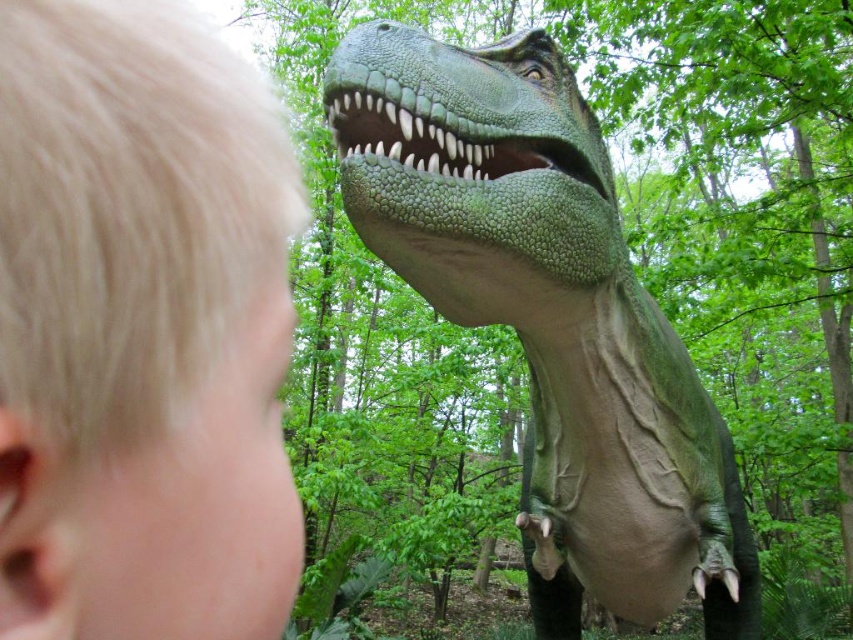
Question: Which point appears farthest from the camera in this image?

Choices:
 (A) (74, 604)
 (B) (462, 109)

Answer: (B)

Question: Is blonde hair at upper left further to the viewer compared to green scaly dinosaur at center?

Choices:
 (A) no
 (B) yes

Answer: (A)

Question: In this image, where is blonde hair at upper left located relative to green scaly dinosaur at center?

Choices:
 (A) above
 (B) below

Answer: (A)

Question: Which object is farther from the camera taking this photo?

Choices:
 (A) blonde hair at upper left
 (B) green scaly dinosaur at center

Answer: (B)

Question: Which object is closer to the camera taking this photo?

Choices:
 (A) green scaly dinosaur at center
 (B) blonde hair at upper left

Answer: (B)

Question: Does blonde hair at upper left lie behind green scaly dinosaur at center?

Choices:
 (A) yes
 (B) no

Answer: (B)